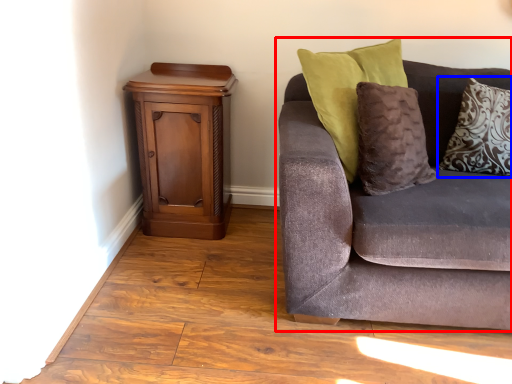
Question: Which object appears farthest to the camera in this image, studio couch (highlighted by a red box) or pillow (highlighted by a blue box)?

Choices:
 (A) studio couch
 (B) pillow

Answer: (B)